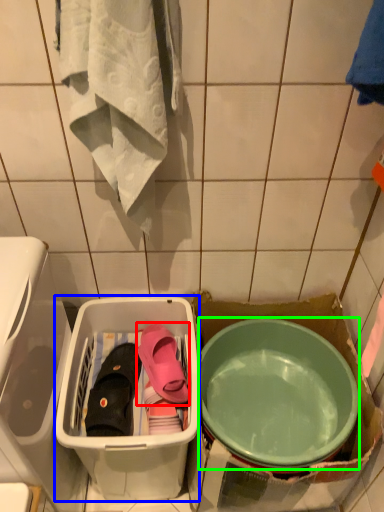
Question: Which object is the farthest from footwear (highlighted by a red box)? Choose among these: storage box (highlighted by a blue box) or mixing bowl (highlighted by a green box).

Choices:
 (A) storage box
 (B) mixing bowl

Answer: (B)